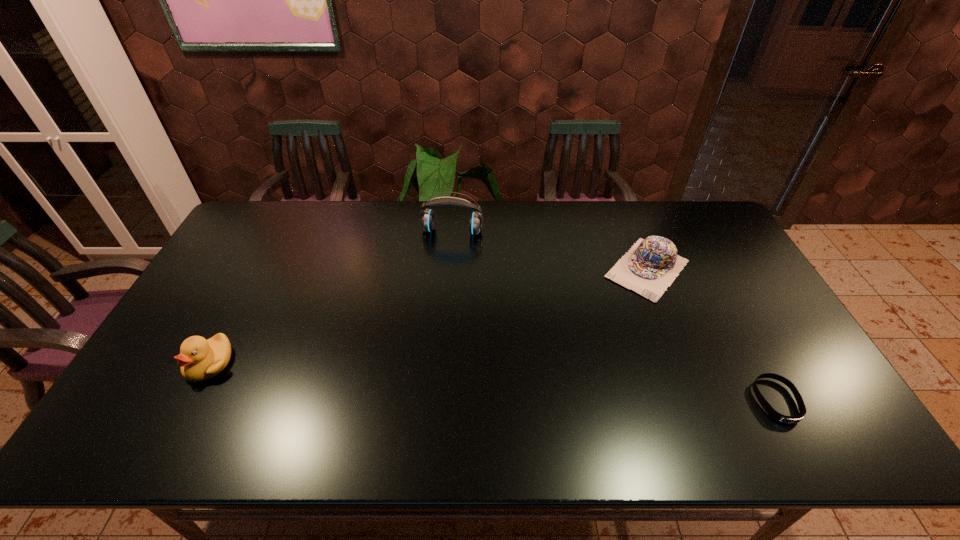
This screenshot has height=540, width=960. I want to click on vacant space that satisfies the following two spatial constraints: 1. on the front side of the second object from left to right; 2. on the right side of the third tallest object, so click(x=449, y=268).